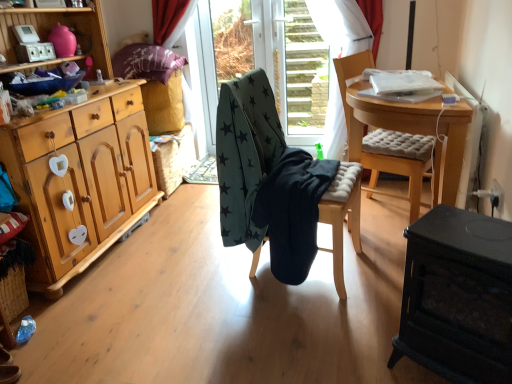
Question: From a real-world perspective, is transparent glass door at center physically below black matte wood table at lower right?

Choices:
 (A) no
 (B) yes

Answer: (A)

Question: Is the depth of transparent glass door at center less than that of black matte wood table at lower right?

Choices:
 (A) yes
 (B) no

Answer: (B)

Question: Considering the relative positions of transparent glass door at center and black matte wood table at lower right in the image provided, is transparent glass door at center behind black matte wood table at lower right?

Choices:
 (A) no
 (B) yes

Answer: (B)

Question: Can you confirm if transparent glass door at center is positioned to the left of black matte wood table at lower right?

Choices:
 (A) no
 (B) yes

Answer: (B)

Question: Is transparent glass door at center turned away from black matte wood table at lower right?

Choices:
 (A) no
 (B) yes

Answer: (A)

Question: Is light wood cabinet at left bigger or smaller than transparent glass door at center?

Choices:
 (A) small
 (B) big

Answer: (B)

Question: Considering the positions of light wood cabinet at left and transparent glass door at center in the image, is light wood cabinet at left wider or thinner than transparent glass door at center?

Choices:
 (A) thin
 (B) wide

Answer: (B)

Question: Is point (42, 114) closer or farther from the camera than point (288, 117)?

Choices:
 (A) farther
 (B) closer

Answer: (B)

Question: From a real-world perspective, is light wood cabinet at left positioned above or below transparent glass door at center?

Choices:
 (A) above
 (B) below

Answer: (A)

Question: From the image's perspective, relative to light brown cushioned chair at center, the second chair from the left, is transparent glass door at center above or below?

Choices:
 (A) below
 (B) above

Answer: (B)

Question: In the image, is transparent glass door at center positioned in front of or behind light brown cushioned chair at center, the second chair from the left?

Choices:
 (A) front
 (B) behind

Answer: (B)

Question: From a real-world perspective, is transparent glass door at center physically located above or below light brown cushioned chair at center, the second chair from the left?

Choices:
 (A) below
 (B) above

Answer: (B)

Question: Is transparent glass door at center situated inside light brown cushioned chair at center, marked as the 1th chair in a right-to-left arrangement, or outside?

Choices:
 (A) outside
 (B) inside

Answer: (A)

Question: Considering their positions, is teal star-patterned fabric at center, which ranks as the first chair in left-to-right order, located in front of or behind dark green fabric stool at center?

Choices:
 (A) behind
 (B) front

Answer: (B)

Question: Is point 257,140 positioned closer to the camera than point 335,190?

Choices:
 (A) closer
 (B) farther

Answer: (B)